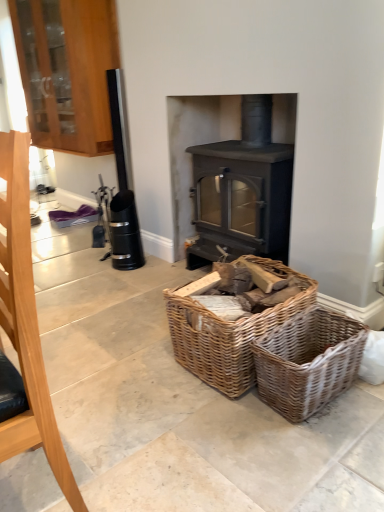
Locate an element on the screen. The width and height of the screenshot is (384, 512). free spot behind brushed metal fireplace tool at left is located at coordinates (94, 425).